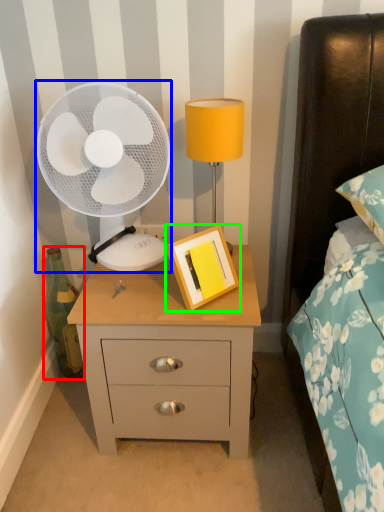
Question: Estimate the real-world distances between objects in this image. Which object is farther from bottle (highlighted by a red box), mechanical fan (highlighted by a blue box) or picture frame (highlighted by a green box)?

Choices:
 (A) mechanical fan
 (B) picture frame

Answer: (B)